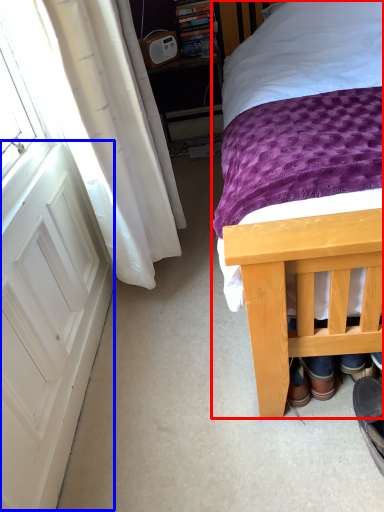
Question: Among these objects, which one is nearest to the camera, bed (highlighted by a red box) or screen door (highlighted by a blue box)?

Choices:
 (A) bed
 (B) screen door

Answer: (A)